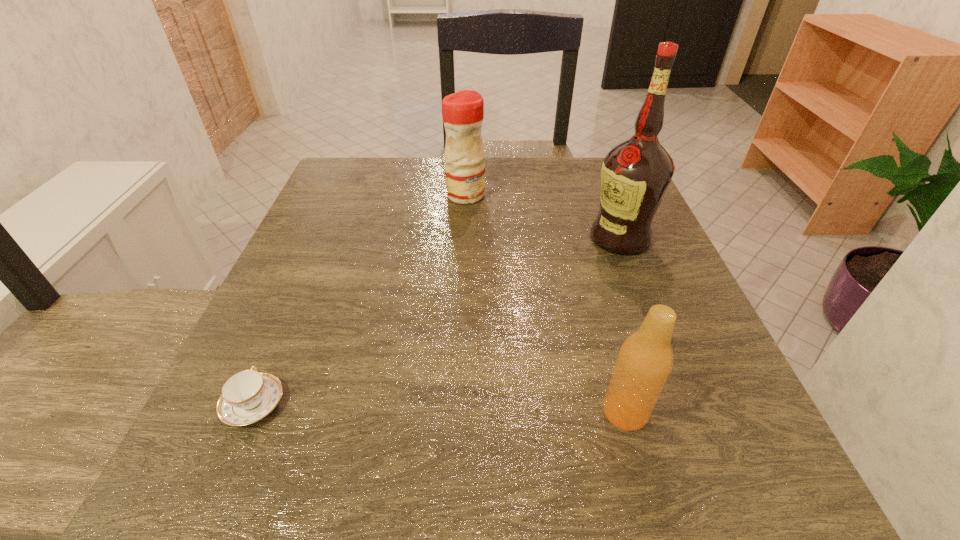
Locate an element on the screen. free point at the near edge is located at coordinates (482, 497).

The width and height of the screenshot is (960, 540). In the image, there is a desktop. What are the coordinates of `free space at the left edge` in the screenshot? It's located at (308, 395).

In the image, there is a desktop. At what (x,y) coordinates should I click in order to perform the action: click on vacant space at the right edge. Please return your answer as a coordinate pair (x, y). Looking at the image, I should click on (684, 326).

The width and height of the screenshot is (960, 540). I want to click on free point at the far left corner, so click(382, 179).

In the image, there is a desktop. In order to click on free space at the near left corner in this screenshot , I will do `click(190, 495)`.

Locate an element on the screen. vacant area at the far right corner is located at coordinates (575, 179).

What are the coordinates of `blank region between the teacup and the second shortest object` in the screenshot? It's located at (440, 408).

What are the coordinates of `empty space that is in between the beer bottle and the third nearest object` in the screenshot? It's located at (622, 325).

You are a GUI agent. You are given a task and a screenshot of the screen. Output one action in this format:
    pyautogui.click(x=<x>, y=<y>)
    Task: Click on the vacant area that lies between the farthest object and the alcohol
    The image size is (960, 540).
    Given the screenshot: What is the action you would take?
    pyautogui.click(x=542, y=217)

Locate an element on the screen. unoccupied position between the third shortest object and the leftmost object is located at coordinates [359, 300].